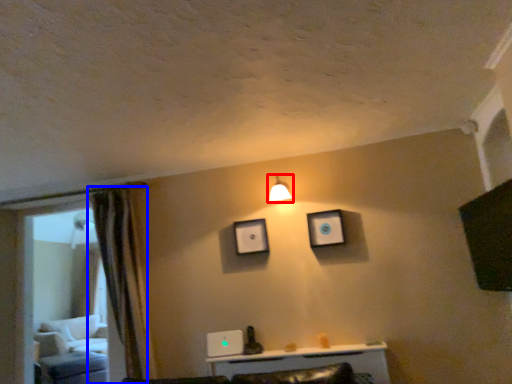
Question: Which object is further to the camera taking this photo, light fixture (highlighted by a red box) or curtain (highlighted by a blue box)?

Choices:
 (A) light fixture
 (B) curtain

Answer: (A)